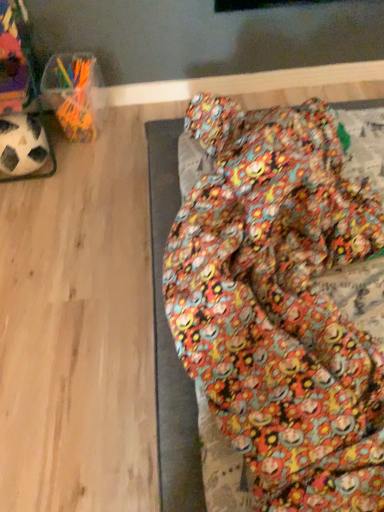
Question: Considering the relative sizes of floral fabric bean bag at lower right and black matte soccer ball at left in the image provided, is floral fabric bean bag at lower right taller than black matte soccer ball at left?

Choices:
 (A) yes
 (B) no

Answer: (B)

Question: From a real-world perspective, is floral fabric bean bag at lower right physically above black matte soccer ball at left?

Choices:
 (A) no
 (B) yes

Answer: (A)

Question: Is floral fabric bean bag at lower right not near black matte soccer ball at left?

Choices:
 (A) no
 (B) yes

Answer: (A)

Question: Does floral fabric bean bag at lower right turn towards black matte soccer ball at left?

Choices:
 (A) yes
 (B) no

Answer: (B)

Question: Is floral fabric bean bag at lower right bigger than black matte soccer ball at left?

Choices:
 (A) no
 (B) yes

Answer: (B)

Question: Does floral fabric bean bag at lower right appear on the right side of black matte soccer ball at left?

Choices:
 (A) yes
 (B) no

Answer: (A)

Question: Considering the relative sizes of black matte soccer ball at left and floral fabric bean bag at lower right in the image provided, is black matte soccer ball at left thinner than floral fabric bean bag at lower right?

Choices:
 (A) no
 (B) yes

Answer: (B)

Question: From the image's perspective, is black matte soccer ball at left over floral fabric bean bag at lower right?

Choices:
 (A) no
 (B) yes

Answer: (B)

Question: Can you see black matte soccer ball at left touching floral fabric bean bag at lower right?

Choices:
 (A) yes
 (B) no

Answer: (B)

Question: Considering the relative sizes of black matte soccer ball at left and floral fabric bean bag at lower right in the image provided, is black matte soccer ball at left bigger than floral fabric bean bag at lower right?

Choices:
 (A) no
 (B) yes

Answer: (A)

Question: Can you confirm if black matte soccer ball at left is wider than floral fabric bean bag at lower right?

Choices:
 (A) yes
 (B) no

Answer: (B)

Question: Is black matte soccer ball at left surrounding floral fabric bean bag at lower right?

Choices:
 (A) yes
 (B) no

Answer: (B)

Question: From their relative heights in the image, would you say black matte soccer ball at left is taller or shorter than floral fabric bean bag at lower right?

Choices:
 (A) short
 (B) tall

Answer: (B)